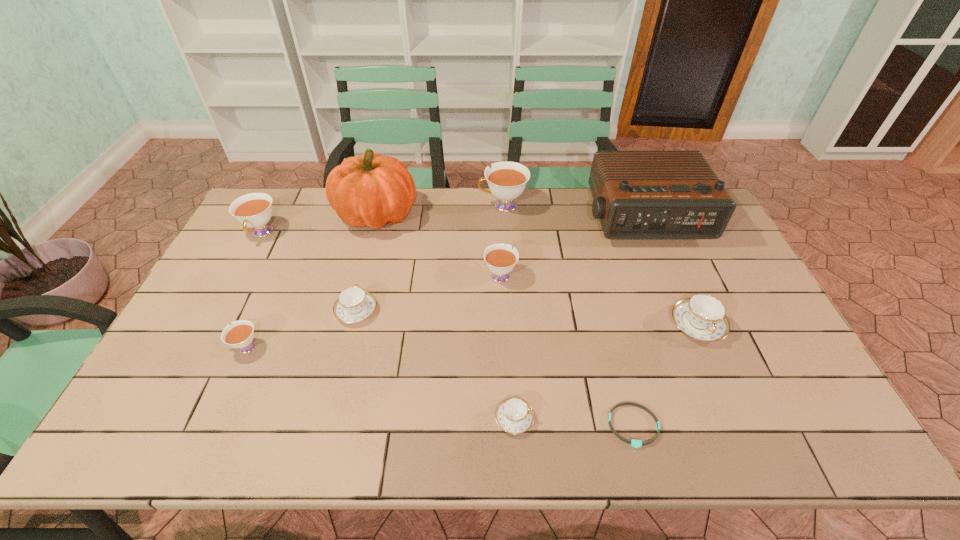
Locate which teacup is the sixth closest to the fifth farthest object. Please provide its 2D coordinates. Your answer should be formatted as a tuple, i.e. [(x, y)], where the tuple contains the x and y coordinates of a point satisfying the conditions above.

[(254, 210)]

Where is `teacup that is the fourth closest to the rightmost teacup`? The height and width of the screenshot is (540, 960). teacup that is the fourth closest to the rightmost teacup is located at coordinates (353, 305).

Where is `the third closest white teacup to the biggest white teacup`? This screenshot has height=540, width=960. the third closest white teacup to the biggest white teacup is located at coordinates (240, 335).

Where is `white teacup that stands as the closest to the ninth shortest object`? This screenshot has width=960, height=540. white teacup that stands as the closest to the ninth shortest object is located at coordinates (507, 180).

The height and width of the screenshot is (540, 960). I want to click on blue teacup that stands as the closest to the tallest object, so click(x=353, y=305).

Locate which blue teacup ranks in proximity to the third white teacup from right to left. Please provide its 2D coordinates. Your answer should be formatted as a tuple, i.e. [(x, y)], where the tuple contains the x and y coordinates of a point satisfying the conditions above.

[(353, 305)]

This screenshot has height=540, width=960. In order to click on free point that satisfies the following two spatial constraints: 1. on the side of the eighth shortest object with the handle; 2. on the front side of the tallest object in this screenshot , I will do `click(503, 214)`.

This screenshot has width=960, height=540. Identify the location of free space that satisfies the following two spatial constraints: 1. on the tuning display of the radio receiver; 2. on the side with the handle of the nearest blue teacup. coord(725,418).